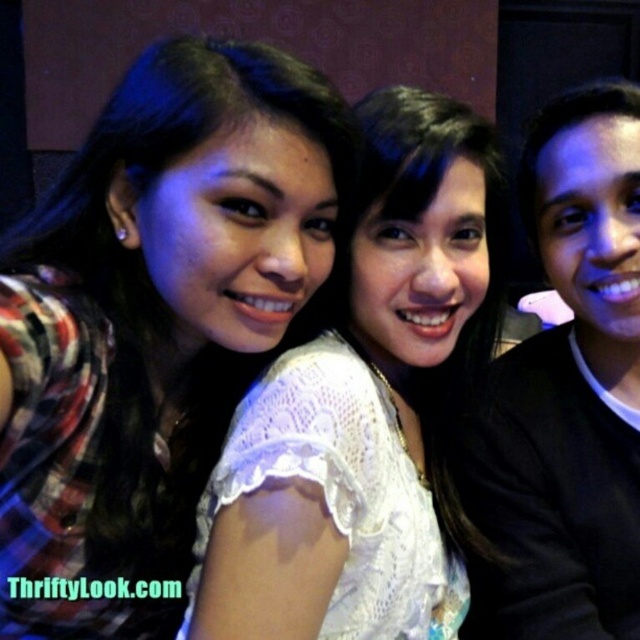
Who is lower down, white lace blouse at center or black matte shirt at right?

white lace blouse at center is below.

Does white lace blouse at center appear on the left side of black matte shirt at right?

Yes, white lace blouse at center is to the left of black matte shirt at right.

Does point (490, 205) come closer to viewer compared to point (621, 461)?

Yes, point (490, 205) is in front of point (621, 461).

Locate an element on the screen. white lace blouse at center is located at coordinates (364, 406).

Who is positioned more to the left, plaid fabric shirt at left or white lace blouse at center?

Positioned to the left is plaid fabric shirt at left.

Is plaid fabric shirt at left closer to camera compared to white lace blouse at center?

Yes.

Does point (179, 68) come behind point (328, 509)?

No, (179, 68) is in front of (328, 509).

Image resolution: width=640 pixels, height=640 pixels. Identify the location of plaid fabric shirt at left. click(x=152, y=323).

Is plaid fabric shirt at left thinner than black matte shirt at right?

No, plaid fabric shirt at left is not thinner than black matte shirt at right.

Who is shorter, plaid fabric shirt at left or black matte shirt at right?

plaid fabric shirt at left is shorter.

Locate an element on the screen. This screenshot has height=640, width=640. plaid fabric shirt at left is located at coordinates pos(152,323).